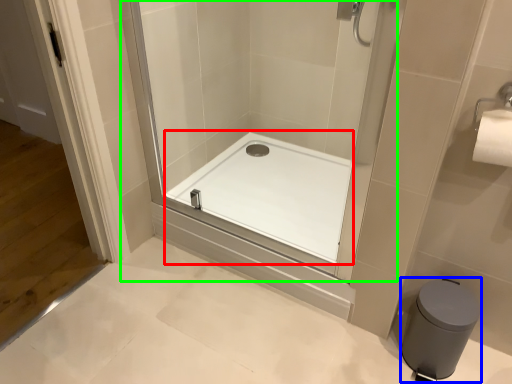
Question: Which is nearer to the bath (highlighted by a red box)? bidet (highlighted by a blue box) or shower door (highlighted by a green box).

Choices:
 (A) bidet
 (B) shower door

Answer: (B)